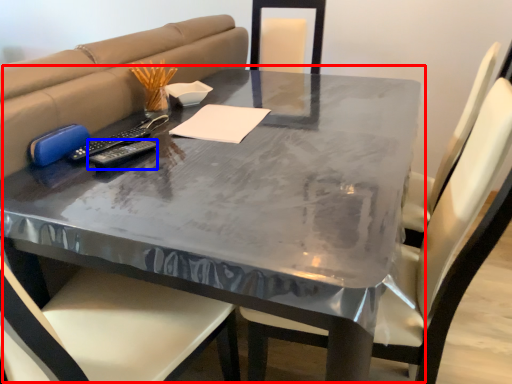
Question: Among these objects, which one is farthest to the camera, table (highlighted by a red box) or remote (highlighted by a blue box)?

Choices:
 (A) table
 (B) remote

Answer: (B)